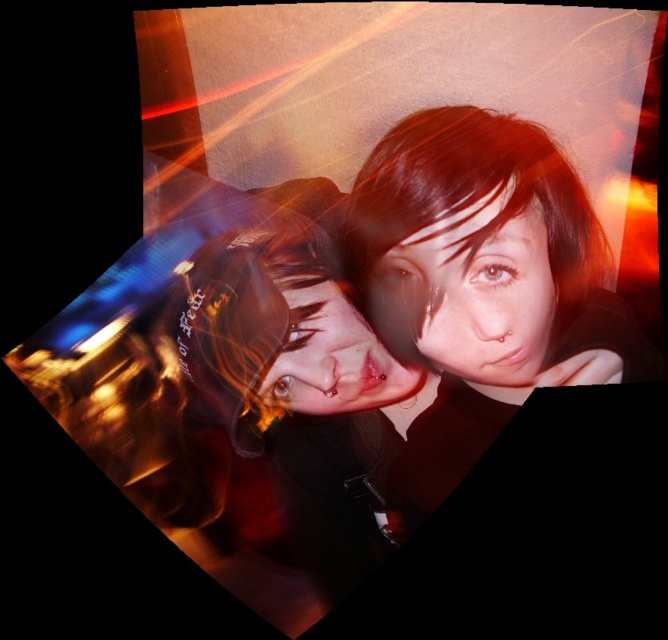
You are a photographer trying to focus on the smooth skin face at center in the image. However, the matte red hair at center is blocking your view. Can you adjust your camera angle to capture the face without the hair obscuring it?

The matte red hair at center is in front of the smooth skin face at center, so adjusting the camera angle to look slightly above or beside the hair could allow capturing the face without obstruction.

You are holding a 24 inch long measuring tape and want to measure the distance from your eyes to the point marked at coordinates point (462, 177) in the image. Can your measuring tape reach that point?

The distance of point (462, 177) from viewer is 28.11 inches, so the 24 inch measuring tape cannot reach it.

Consider the image. You are a photographer trying to adjust the focus of your camera. The point you want to focus on is at point [514,376]. The camera has a depth of field that can cover objects within 30 inches from the current focus point. Is the point within the depth of field range?

The distance of point [514,376] from camera is 29.83 inches, so the point is within the depth of field range since it is within 30 inches.